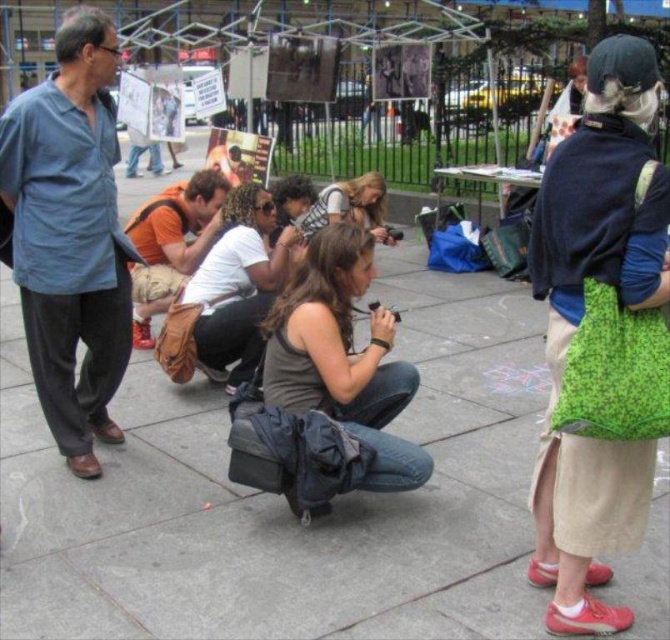
Is blue cotton shirt at upper left taller than matte brown hair at center?

Correct, blue cotton shirt at upper left is much taller as matte brown hair at center.

Is blue cotton shirt at upper left behind matte brown hair at center?

That is False.

This screenshot has height=640, width=670. Describe the element at coordinates (70, 236) in the screenshot. I see `blue cotton shirt at upper left` at that location.

Locate an element on the screen. blue cotton shirt at upper left is located at coordinates (70, 236).

Can you confirm if dark green tank top at center is positioned to the right of matte brown hair at center?

In fact, dark green tank top at center is to the left of matte brown hair at center.

How much distance is there between dark green tank top at center and matte brown hair at center?

A distance of 2.39 meters exists between dark green tank top at center and matte brown hair at center.

Is point (373, 348) more distant than point (360, 177)?

No, it is not.

Identify the location of dark green tank top at center. (342, 356).

Is dark green tank top at center in front of denim jeans at center?

That is True.

What do you see at coordinates (342, 356) in the screenshot?
I see `dark green tank top at center` at bounding box center [342, 356].

The width and height of the screenshot is (670, 640). Identify the location of dark green tank top at center. (342, 356).